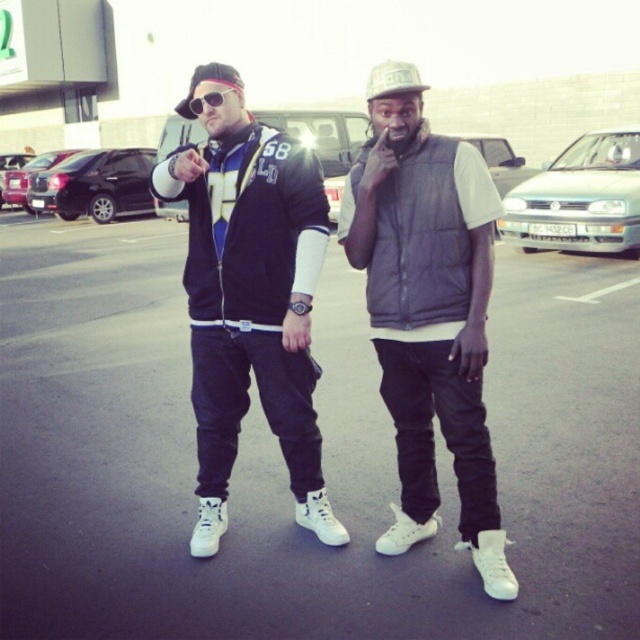
You are trying to decide which object is larger between the matte gray vest at center and the matte black sunglasses at center. Based on the scene description, which one is bigger?

The matte gray vest at center is bigger than the matte black sunglasses at center according to the description.

You are a photographer trying to capture a clear shot of the matte black jacket at center and the matte black sunglasses at center. Since both are in the same area, which one should you focus on first to ensure it is in the foreground?

The matte black jacket at center is located below the matte black sunglasses at center, so focusing on the matte black jacket at center first will ensure it is in the foreground.